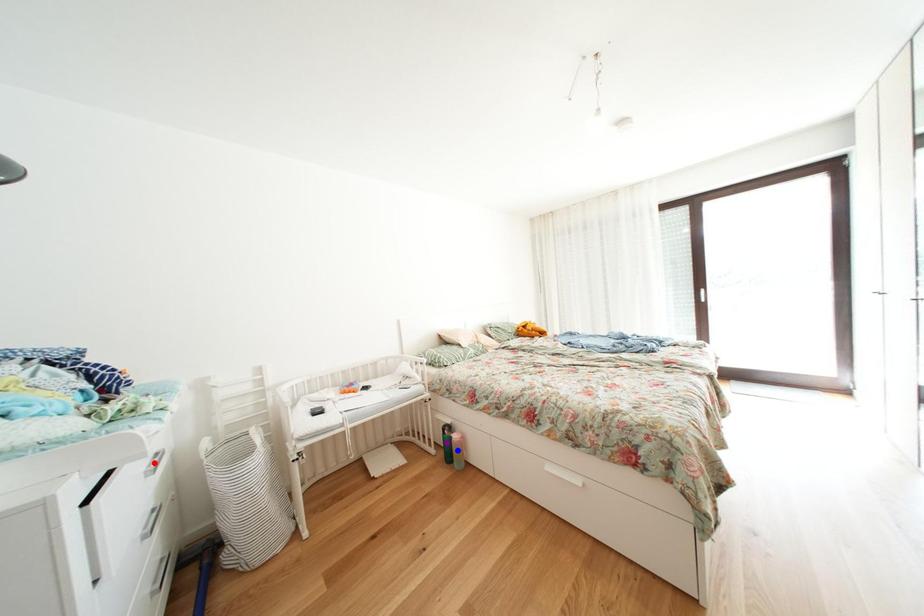
Order these from nearest to farthest:
1. red point
2. purple point
3. blue point

red point, blue point, purple point